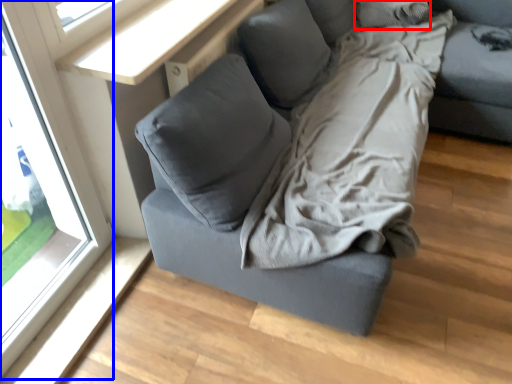
Question: Among these objects, which one is nearest to the camera, pillow (highlighted by a red box) or window (highlighted by a blue box)?

Choices:
 (A) pillow
 (B) window

Answer: (B)